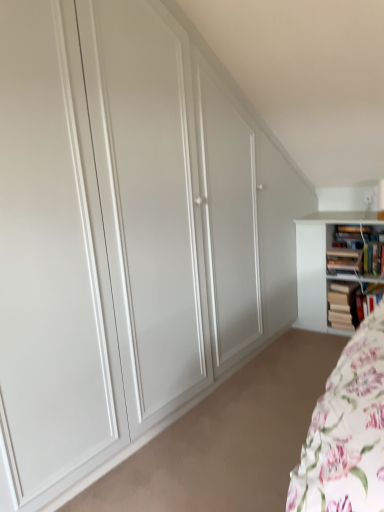
Question: From the image's perspective, relative to wooden bookshelf at right, the 3th book positioned from the bottom, is wooden book at right, which appears as the 3th book when viewed from the top, above or below?

Choices:
 (A) below
 (B) above

Answer: (A)

Question: Considering the positions of point (337, 315) and point (344, 268), is point (337, 315) closer or farther from the camera than point (344, 268)?

Choices:
 (A) closer
 (B) farther

Answer: (B)

Question: Which object is positioned closest to the wooden bookshelf at right, the second book when ordered from top to bottom?

Choices:
 (A) hardcover book at right, placed as the fourth book when sorted from top to bottom
 (B) hardcover books at upper right, the fourth book when ordered from bottom to top
 (C) wooden book at right, which appears as the 3th book when viewed from the top

Answer: (B)

Question: Which of these objects is positioned closest to the wooden book at right, which appears as the 3th book when viewed from the top?

Choices:
 (A) hardcover books at upper right, the fourth book when ordered from bottom to top
 (B) hardcover book at right, which is counted as the first book, starting from the bottom
 (C) wooden bookshelf at right, the 3th book positioned from the bottom

Answer: (B)